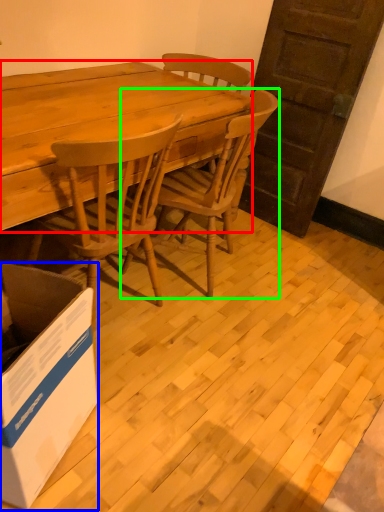
Question: Which is farther away from desk (highlighted by a red box)? box (highlighted by a blue box) or chair (highlighted by a green box)?

Choices:
 (A) box
 (B) chair

Answer: (A)